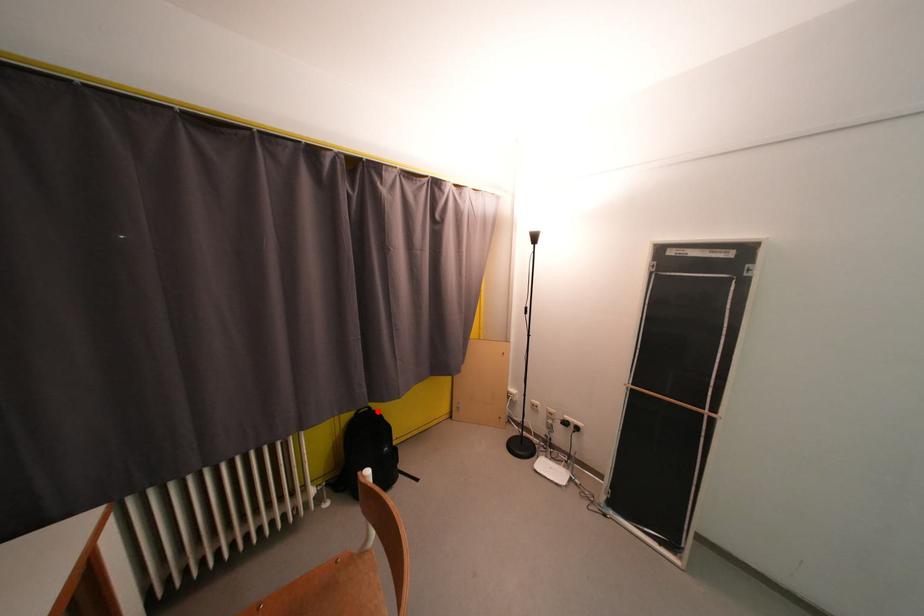
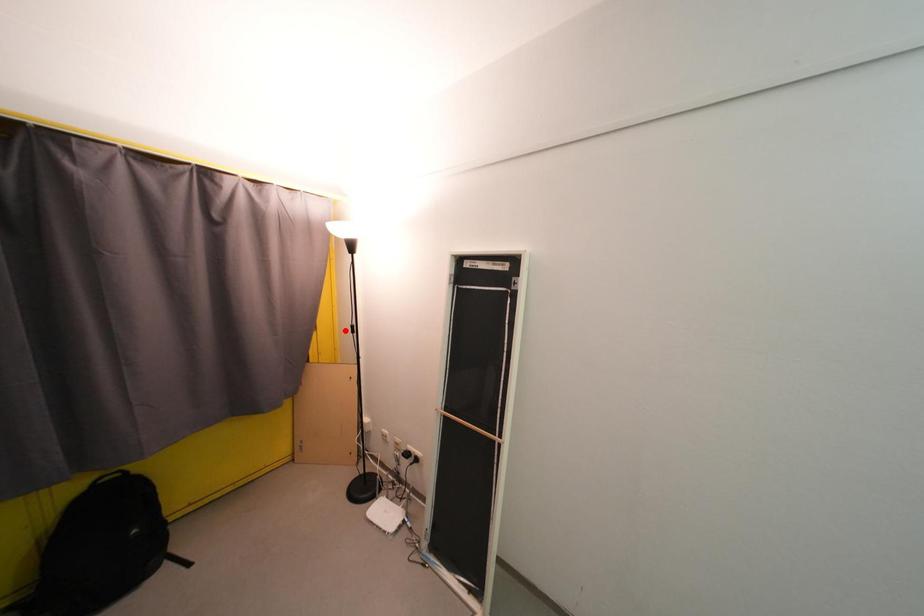
I am providing you with two images of the same scene from different viewpoints. A red point is marked on the first image and another point is marked on the second image. Is the marked point in image1 the same physical position as the marked point in image2?

No